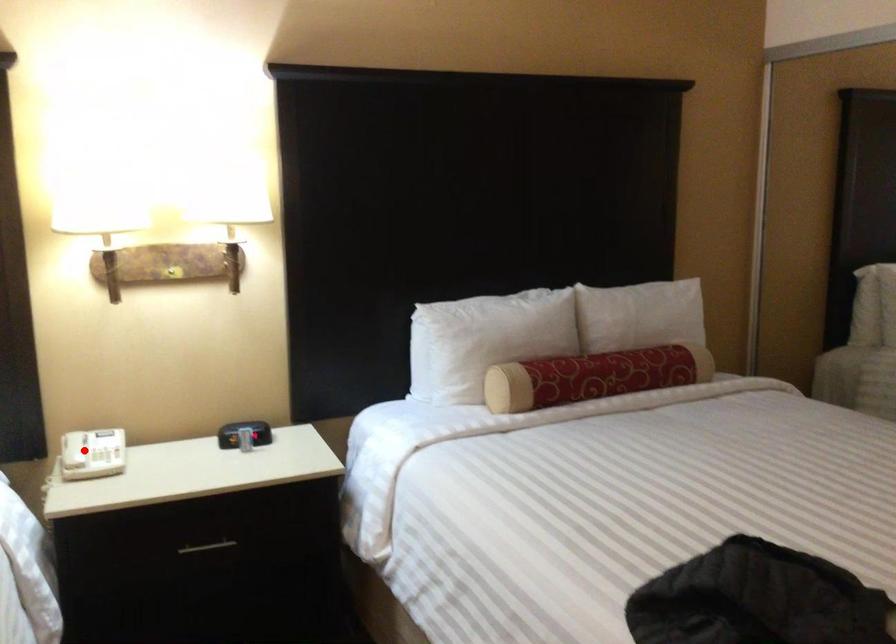
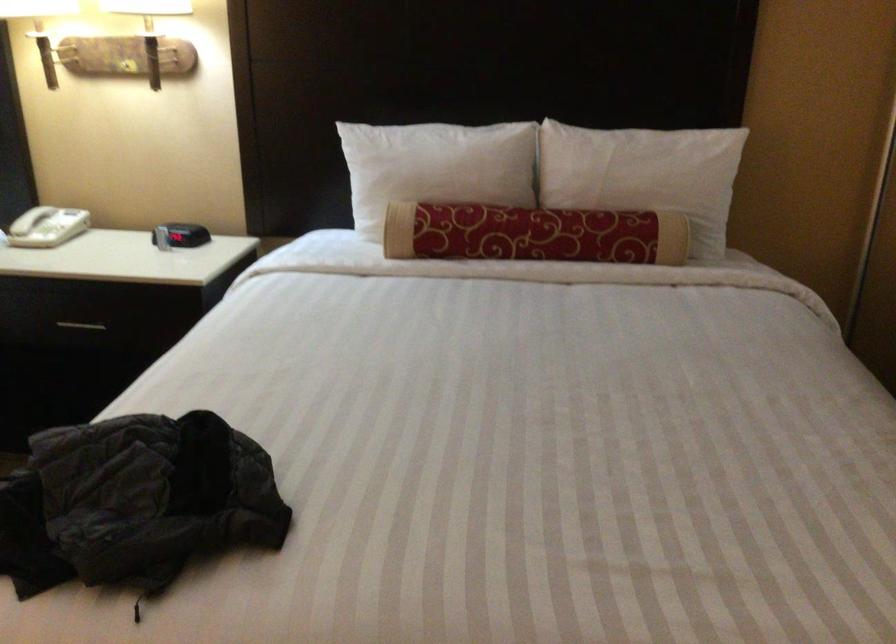
Question: I am providing you with two images of the same scene from different viewpoints. A red point is marked on the first image. At the location where the point appears in image 1, is it still visible in image 2?

Choices:
 (A) Yes
 (B) No

Answer: (A)